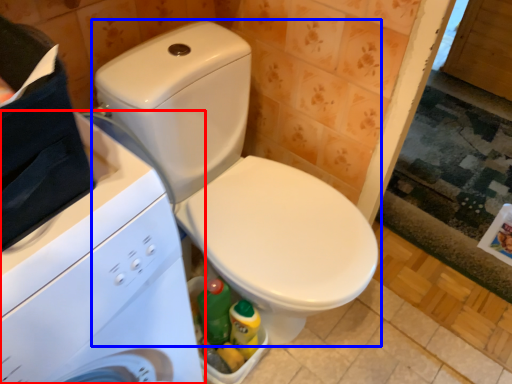
Question: Which object is further to the camera taking this photo, washing machine (highlighted by a red box) or toilet (highlighted by a blue box)?

Choices:
 (A) washing machine
 (B) toilet

Answer: (B)